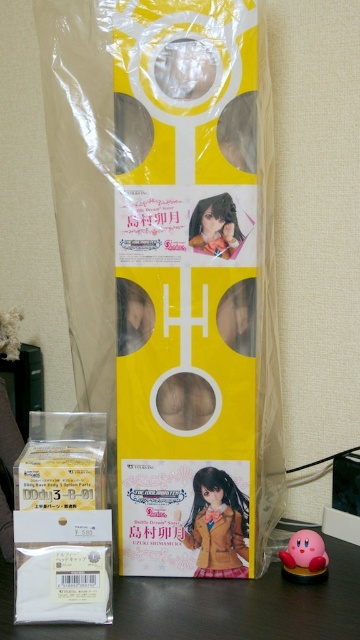
Does yellow matte paper bag at center have a lesser height compared to matte brown doll at center?

In fact, yellow matte paper bag at center may be taller than matte brown doll at center.

The image size is (360, 640). What do you see at coordinates (171, 268) in the screenshot?
I see `yellow matte paper bag at center` at bounding box center [171, 268].

Locate an element on the screen. yellow matte paper bag at center is located at coordinates (171, 268).

Is point (99, 388) behind point (294, 570)?

Yes, point (99, 388) is farther from viewer.

Is point (150, 147) closer to viewer compared to point (298, 563)?

Yes, point (150, 147) is closer to viewer.

Which is in front, point (96, 192) or point (285, 548)?

Point (96, 192) is in front.

Identify the location of yellow matte paper bag at center. (171, 268).

Measure the distance from white matte paper at lower center to pink rubber kirby at lower right.

They are 5.32 inches apart.

Where is `white matte paper at lower center`? The height and width of the screenshot is (640, 360). white matte paper at lower center is located at coordinates (216, 605).